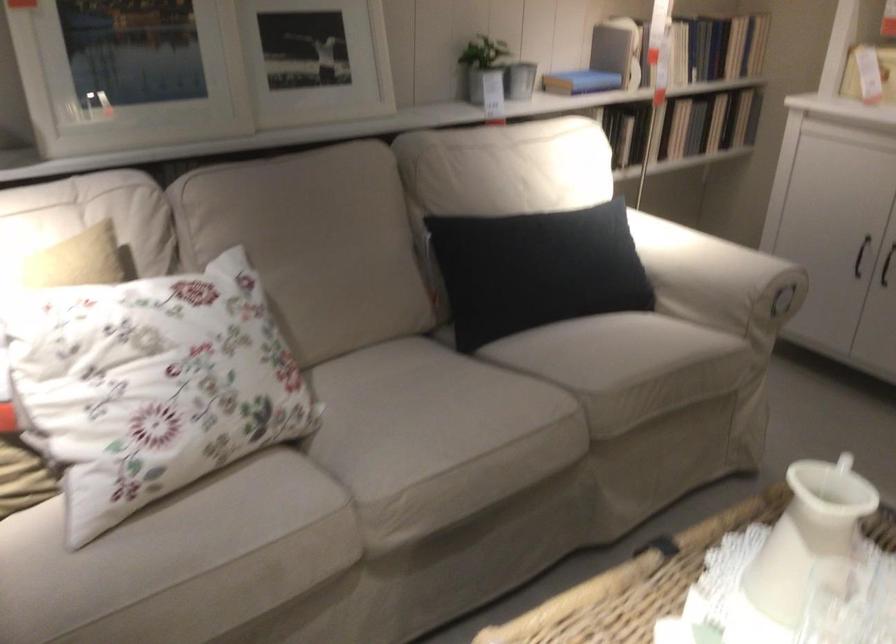
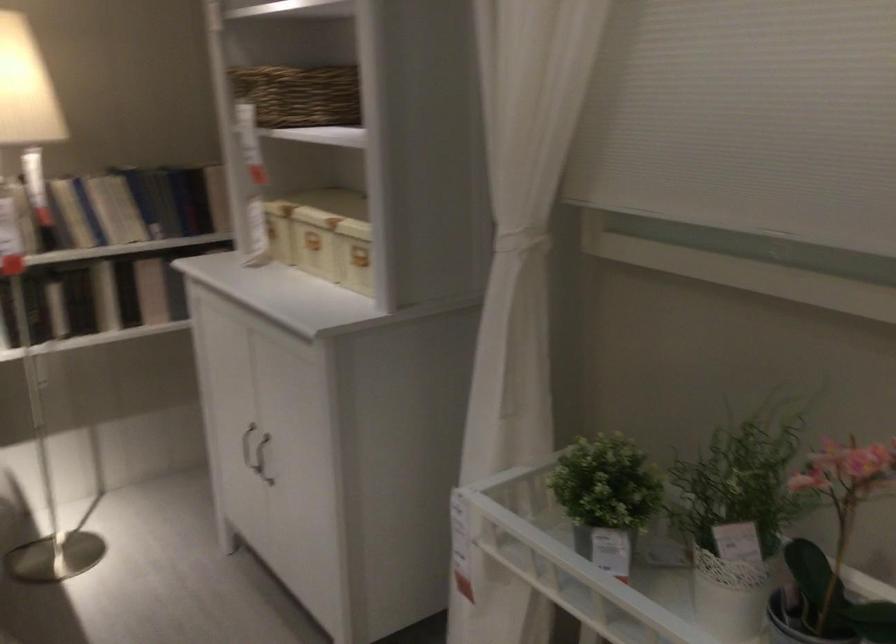
Question: Which direction would the cameraman need to move to produce the second image? Reply with the corresponding letter.

Choices:
 (A) Left
 (B) Right
 (C) Forward
 (D) Backward

Answer: (B)